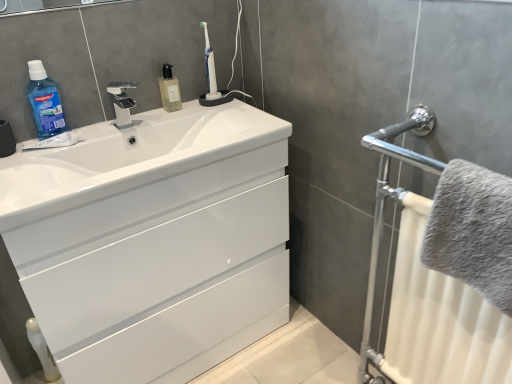
Locate an element on the screen. white glossy cabinet at center is located at coordinates (148, 236).

This screenshot has width=512, height=384. What do you see at coordinates (128, 157) in the screenshot?
I see `white glossy sink at center` at bounding box center [128, 157].

Locate an element on the screen. white plastic toothbrush at upper center is located at coordinates (210, 67).

What do you see at coordinates (472, 230) in the screenshot?
I see `gray fluffy towel at right` at bounding box center [472, 230].

Find the location of `blue translucent liquid at upper left`. blue translucent liquid at upper left is located at coordinates (45, 101).

Would you say white glossy cabinet at center is outside white glossy sink at center?

Yes.

Between white glossy cabinet at center and white glossy sink at center, which one appears on the right side from the viewer's perspective?

white glossy sink at center is more to the right.

In the image, is white glossy cabinet at center positioned in front of or behind white glossy sink at center?

white glossy cabinet at center is positioned closer to the viewer than white glossy sink at center.

The width and height of the screenshot is (512, 384). What are the coordinates of `sink to the right of white glossy cabinet at center` in the screenshot? It's located at (128, 157).

Is white glossy sink at center facing away from white plastic toothbrush at upper center?

That's not correct — white glossy sink at center is not looking away from white plastic toothbrush at upper center.

Is white glossy sink at center behind white plastic toothbrush at upper center?

No, white glossy sink at center is closer to the viewer.

Considering the relative positions of white glossy sink at center and white plastic toothbrush at upper center in the image provided, is white glossy sink at center to the right of white plastic toothbrush at upper center from the viewer's perspective?

No.

From the image's perspective, is white glossy sink at center positioned above or below white plastic toothbrush at upper center?

From the image's perspective, white glossy sink at center appears below white plastic toothbrush at upper center.

At what (x,y) coordinates should I click in order to perform the action: click on bathroom cabinet lying below the polished chrome tap at upper center (from the image's perspective). Please return your answer as a coordinate pair (x, y). The image size is (512, 384). Looking at the image, I should click on (148, 236).

From a real-world perspective, is white glossy cabinet at center located higher than polished chrome tap at upper center?

Actually, white glossy cabinet at center is physically below polished chrome tap at upper center in the real world.

Is the depth of white glossy cabinet at center greater than that of polished chrome tap at upper center?

No, it is not.

Based on the photo, which of these two, white glossy cabinet at center or translucent glass soap dispenser at upper center, is thinner?

translucent glass soap dispenser at upper center.

Consider the image. Is white glossy cabinet at center spatially inside translucent glass soap dispenser at upper center, or outside of it?

white glossy cabinet at center lies outside translucent glass soap dispenser at upper center.

Which object is further away from the camera, white glossy cabinet at center or translucent glass soap dispenser at upper center?

translucent glass soap dispenser at upper center.

Is translucent glass soap dispenser at upper center inside polished chrome tap at upper center?

No.

Is the position of polished chrome tap at upper center less distant than that of translucent glass soap dispenser at upper center?

Yes, polished chrome tap at upper center is closer to the viewer.

How many degrees apart are the facing directions of polished chrome tap at upper center and translucent glass soap dispenser at upper center?

There is a 0.00172-degree angle between the facing directions of polished chrome tap at upper center and translucent glass soap dispenser at upper center.

Which object is wider, polished chrome tap at upper center or translucent glass soap dispenser at upper center?

Wider between the two is translucent glass soap dispenser at upper center.

How different are the orientations of white plastic toothbrush at upper center and translucent glass soap dispenser at upper center in degrees?

They differ by 0.00047 degrees in their facing directions.

Is white plastic toothbrush at upper center with translucent glass soap dispenser at upper center?

There is a gap between white plastic toothbrush at upper center and translucent glass soap dispenser at upper center.

Is point (205, 53) positioned behind point (172, 89)?

Yes.

Does white plastic toothbrush at upper center turn towards translucent glass soap dispenser at upper center?

No, white plastic toothbrush at upper center is not facing towards translucent glass soap dispenser at upper center.

In the scene shown: Who is shorter, blue translucent liquid at upper left or translucent glass soap dispenser at upper center?

translucent glass soap dispenser at upper center.

Is blue translucent liquid at upper left inside the boundaries of translucent glass soap dispenser at upper center, or outside?

blue translucent liquid at upper left is outside translucent glass soap dispenser at upper center.

From a real-world perspective, is blue translucent liquid at upper left above or below translucent glass soap dispenser at upper center?

blue translucent liquid at upper left is above translucent glass soap dispenser at upper center.

Which is in front, blue translucent liquid at upper left or translucent glass soap dispenser at upper center?

Positioned in front is blue translucent liquid at upper left.

Locate an element on the screen. This screenshot has height=384, width=512. bathroom cabinet in front of the white glossy sink at center is located at coordinates (148, 236).

Identify the location of toothbrush that is above the white glossy sink at center (from the image's perspective). (210, 67).

Looking at the image, which one is located further to polished chrome tap at upper center, white plastic toothbrush at upper center or white glossy sink at center?

Based on the image, white plastic toothbrush at upper center appears to be further to polished chrome tap at upper center.

From the image, which object appears to be farther from white glossy sink at center, blue translucent liquid at upper left or polished chrome tap at upper center?

blue translucent liquid at upper left is further to white glossy sink at center.

Estimate the real-world distances between objects in this image. Which object is further from white glossy sink at center, white plastic toothbrush at upper center or gray fluffy towel at right?

gray fluffy towel at right.

Looking at the image, which one is located further to translucent glass soap dispenser at upper center, white plastic toothbrush at upper center or gray fluffy towel at right?

gray fluffy towel at right is positioned further to the anchor translucent glass soap dispenser at upper center.

From the image, which object appears to be nearer to blue translucent liquid at upper left, white glossy sink at center or white glossy cabinet at center?

The object closer to blue translucent liquid at upper left is white glossy sink at center.

From the image, which object appears to be nearer to blue translucent liquid at upper left, white glossy sink at center or polished chrome tap at upper center?

polished chrome tap at upper center.

Which object lies nearer to the anchor point white plastic toothbrush at upper center, translucent glass soap dispenser at upper center or blue translucent liquid at upper left?

Based on the image, translucent glass soap dispenser at upper center appears to be nearer to white plastic toothbrush at upper center.

Estimate the real-world distances between objects in this image. Which object is closer to gray fluffy towel at right, white glossy sink at center or polished chrome tap at upper center?

The object closer to gray fluffy towel at right is white glossy sink at center.

Find the location of `tap between blue translucent liquid at upper left and white plastic toothbrush at upper center`. tap between blue translucent liquid at upper left and white plastic toothbrush at upper center is located at coordinates (121, 102).

Locate an element on the screen. The image size is (512, 384). bathroom cabinet situated between blue translucent liquid at upper left and gray fluffy towel at right from left to right is located at coordinates (148, 236).

This screenshot has height=384, width=512. I want to click on mouthwash between blue translucent liquid at upper left and gray fluffy towel at right, so click(x=169, y=90).

The width and height of the screenshot is (512, 384). In order to click on toothbrush between blue translucent liquid at upper left and gray fluffy towel at right in the horizontal direction in this screenshot , I will do `click(210, 67)`.